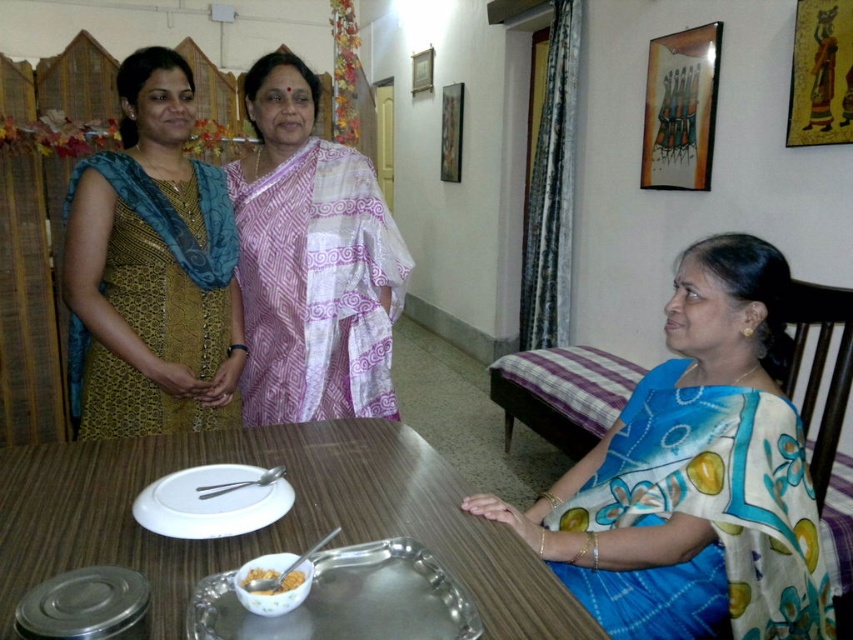
Does pink silk saree at center appear on the right side of white matte plate at lower center?

Correct, you'll find pink silk saree at center to the right of white matte plate at lower center.

Is point (299, 280) positioned after point (277, 506)?

Yes.

This screenshot has width=853, height=640. Identify the location of pink silk saree at center. (311, 260).

Between point (555, 547) and point (331, 321), which one is positioned in front?

Point (555, 547) is more forward.

Can you confirm if blue floral saree at right is positioned to the left of pink silk saree at center?

In fact, blue floral saree at right is to the right of pink silk saree at center.

Describe the element at coordinates (695, 476) in the screenshot. This screenshot has width=853, height=640. I see `blue floral saree at right` at that location.

Find the location of `blue floral saree at right`. blue floral saree at right is located at coordinates (695, 476).

Is silver metallic tray at lower center bigger than white glossy bowl at lower center?

Yes.

Who is higher up, silver metallic tray at lower center or white glossy bowl at lower center?

white glossy bowl at lower center

Is point (410, 568) farther from camera compared to point (271, 602)?

Yes, point (410, 568) is behind point (271, 602).

This screenshot has height=640, width=853. Identify the location of silver metallic tray at lower center. (347, 600).